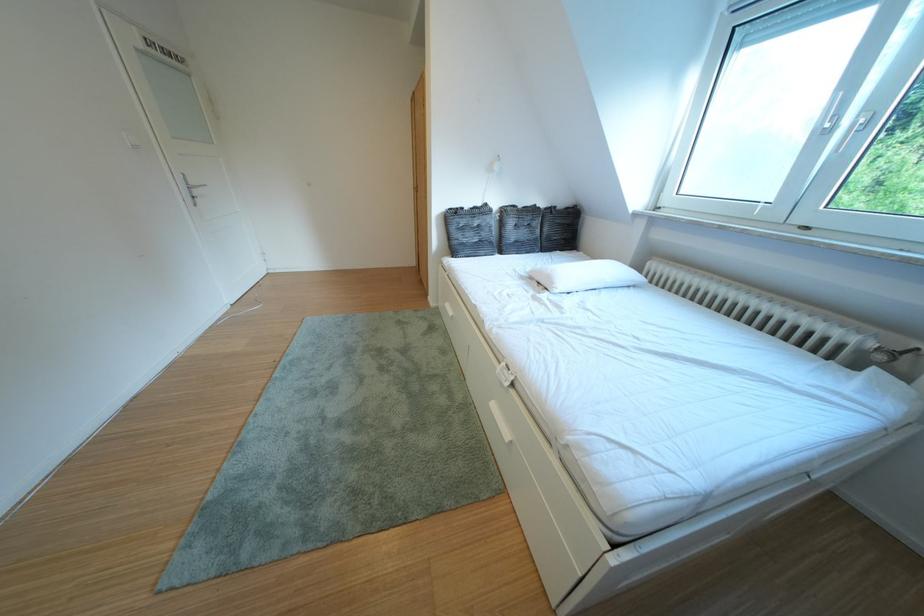
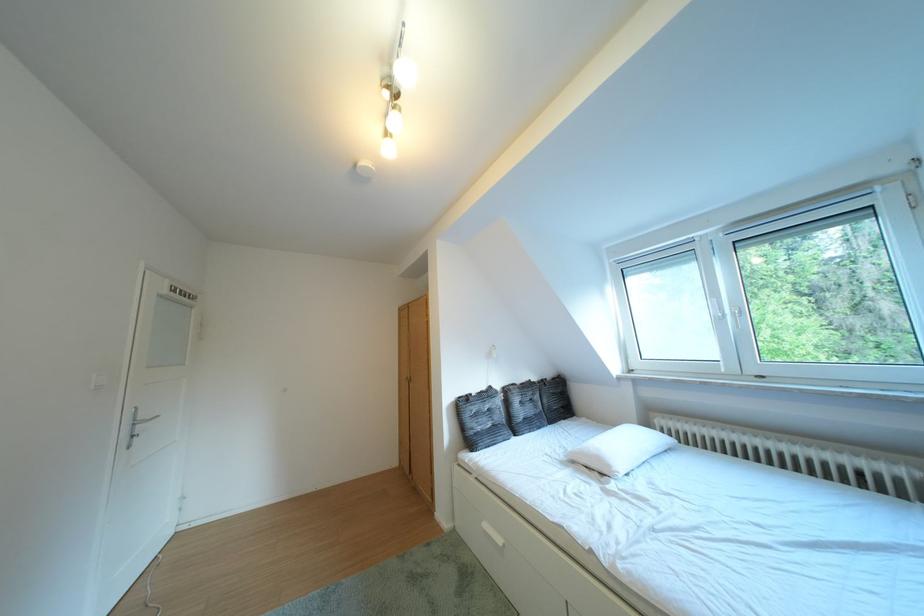
In the second image, find the point that corresponds to (193,180) in the first image.

(141, 418)